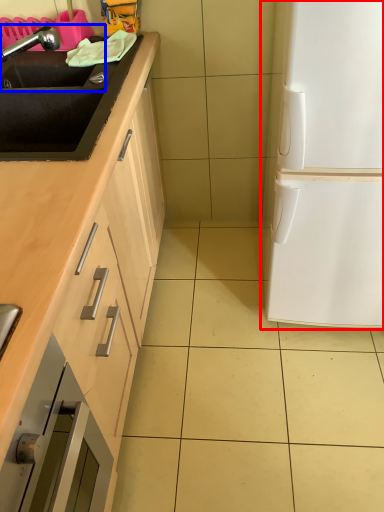
Question: Which object appears closest to the camera in this image, fridge (highlighted by a red box) or sink (highlighted by a blue box)?

Choices:
 (A) fridge
 (B) sink

Answer: (A)